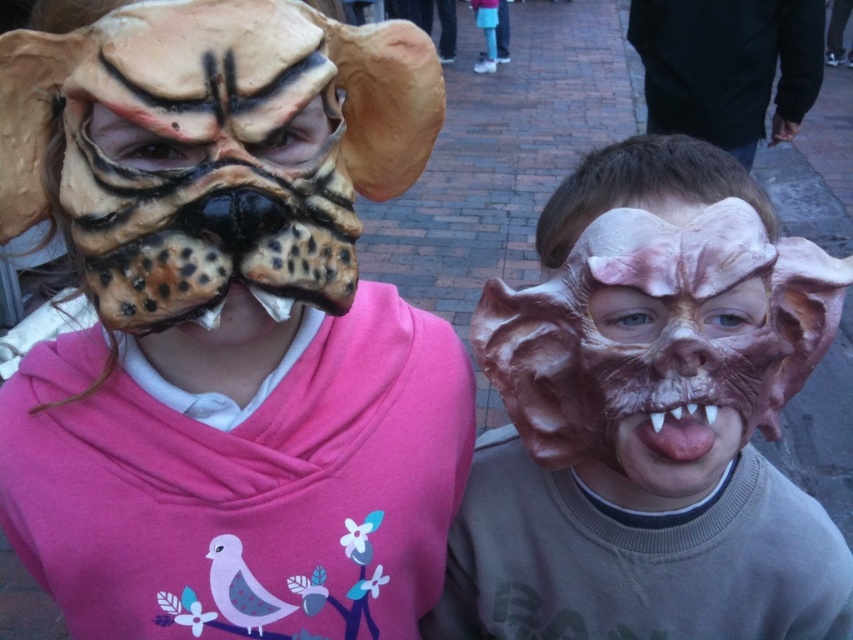
Question: Among these points, which one is nearest to the camera?

Choices:
 (A) (756, 300)
 (B) (263, 301)
 (C) (648, 436)
 (D) (334, 621)

Answer: (B)

Question: Which is farther from the matte pink mask at right?

Choices:
 (A) matte pink sweatshirt at left
 (B) matte brown mask at left

Answer: (B)

Question: Does matte pink sweatshirt at left appear on the right side of pink glossy tongue at center?

Choices:
 (A) no
 (B) yes

Answer: (A)

Question: Does matte pink sweatshirt at left appear under matte pink mask at right?

Choices:
 (A) yes
 (B) no

Answer: (B)

Question: Based on their relative distances, which object is nearer to the matte pink mask at right?

Choices:
 (A) sculpted rubber mask at center
 (B) matte pink sweatshirt at left
 (C) pink glossy tongue at center

Answer: (A)

Question: Observing the image, what is the correct spatial positioning of matte pink sweatshirt at left in reference to matte brown mask at left?

Choices:
 (A) left
 (B) right

Answer: (A)